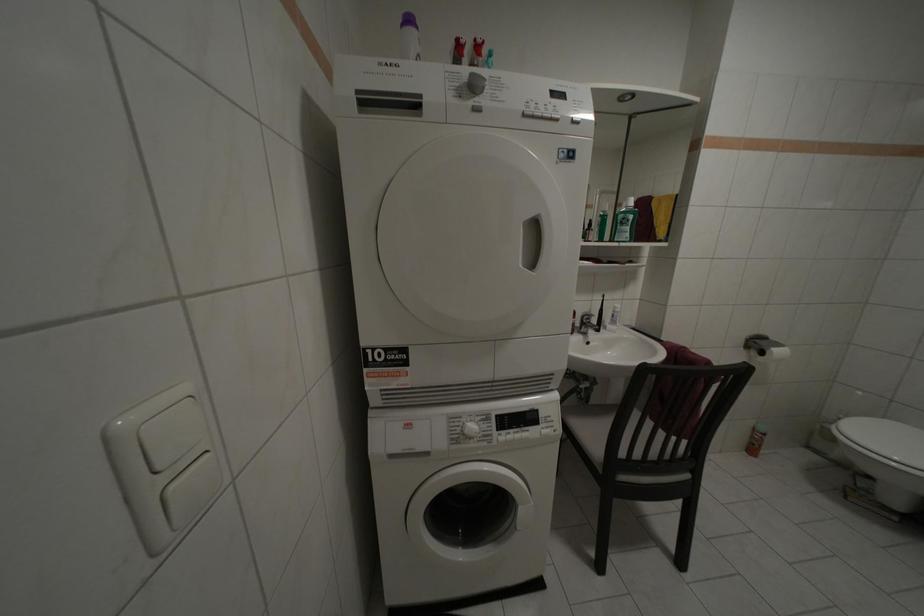
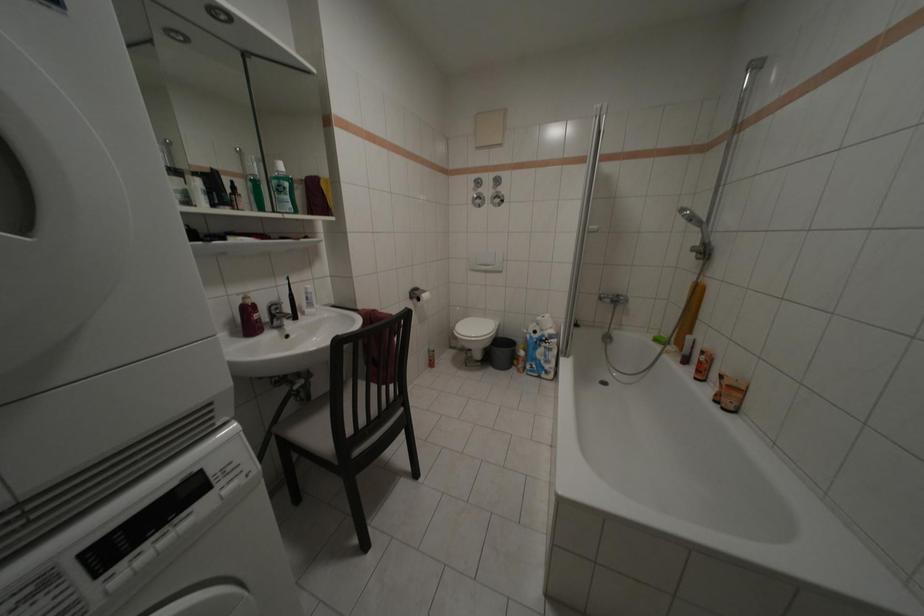
Question: The images are taken continuously from a first-person perspective. In which direction is your viewpoint rotating?

Choices:
 (A) Left
 (B) Right
 (C) Up
 (D) Down

Answer: (B)